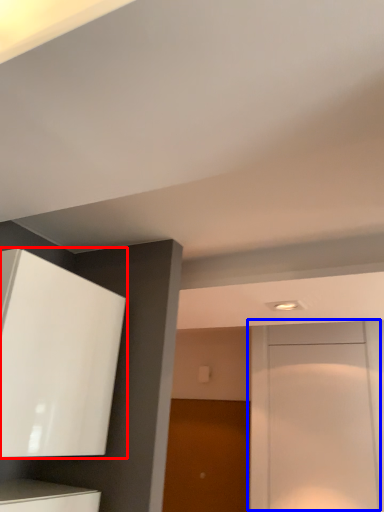
Question: Which of the following is the closest to the observer, cabinetry (highlighted by a red box) or door (highlighted by a blue box)?

Choices:
 (A) cabinetry
 (B) door

Answer: (A)